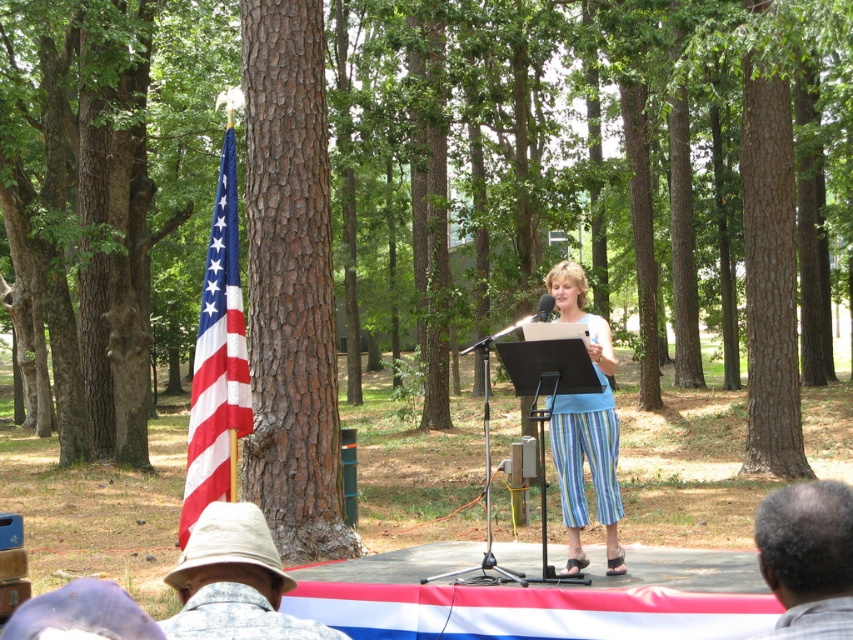
Does american flag at left appear on the right side of blue striped pants at center?

Incorrect, american flag at left is not on the right side of blue striped pants at center.

Locate an element on the screen. The image size is (853, 640). american flag at left is located at coordinates (218, 360).

Can you confirm if american flag at left is positioned to the left of gray plaid shirt at lower right?

Indeed, american flag at left is positioned on the left side of gray plaid shirt at lower right.

Which is in front, point (219, 312) or point (837, 602)?

Point (837, 602) is more forward.

Where is `american flag at left`? This screenshot has width=853, height=640. american flag at left is located at coordinates (218, 360).

Who is shorter, brown rough bark tree at left or black plastic microphone at center?

black plastic microphone at center is shorter.

Is brown rough bark tree at left shorter than black plastic microphone at center?

Incorrect, brown rough bark tree at left's height does not fall short of black plastic microphone at center's.

Image resolution: width=853 pixels, height=640 pixels. In order to click on brown rough bark tree at left in this screenshot , I will do `click(289, 284)`.